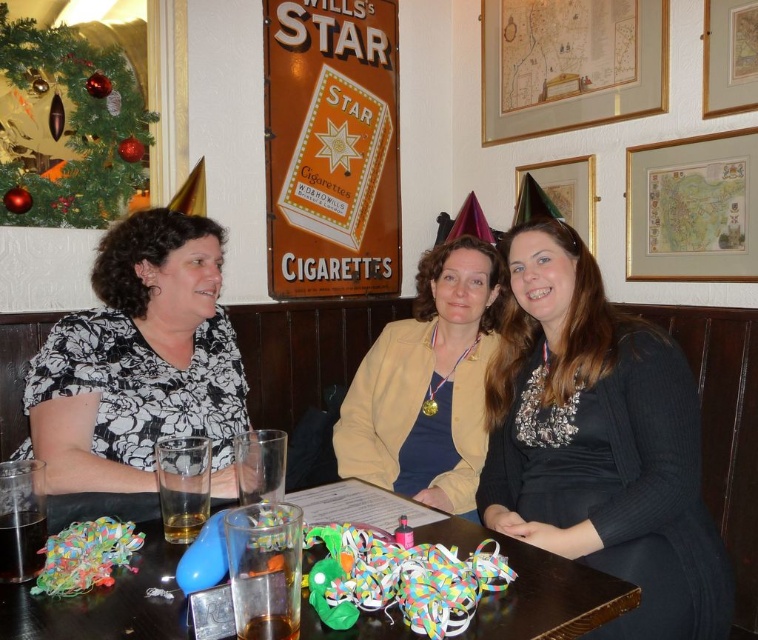
Question: Among these objects, which one is nearest to the camera?

Choices:
 (A) black floral blouse at left
 (B) translucent glass at table left
 (C) multicolored paper streamers at table center

Answer: (C)

Question: Does black ribbed sweater at center have a smaller size compared to translucent plastic cups at center?

Choices:
 (A) no
 (B) yes

Answer: (A)

Question: Considering the real-world distances, which object is closest to the black floral blouse at left?

Choices:
 (A) translucent glass at table left
 (B) multicolored paper streamers at table center
 (C) dark brown glass at lower left
 (D) translucent plastic cups at center

Answer: (D)

Question: Can you confirm if translucent glass at table center is positioned to the right of translucent glass at table left?

Choices:
 (A) yes
 (B) no

Answer: (A)

Question: Which point is farther from the camera taking this photo?

Choices:
 (A) (80, 392)
 (B) (612, 317)

Answer: (B)

Question: Is translucent plastic cups at center smaller than translucent glass at table left?

Choices:
 (A) no
 (B) yes

Answer: (A)